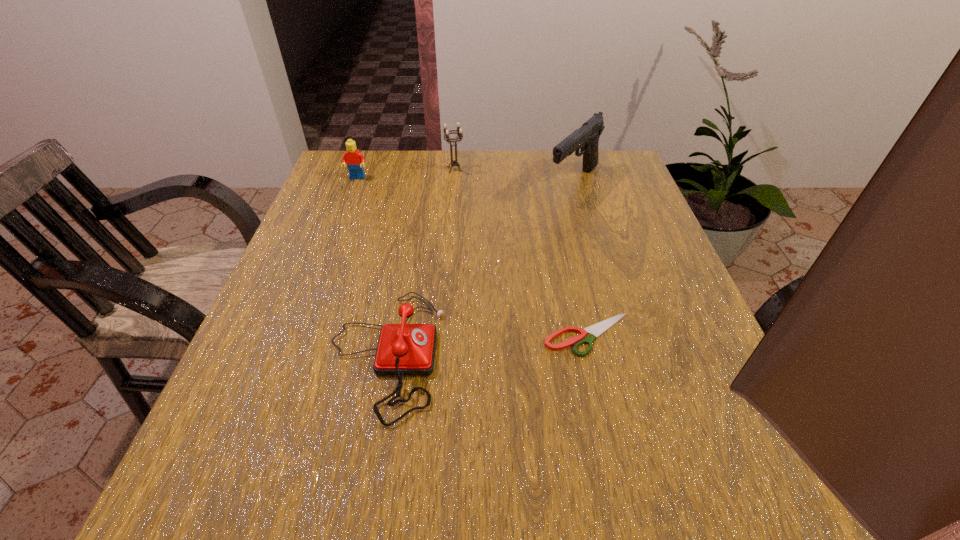
The height and width of the screenshot is (540, 960). Identify the location of free space located 0.160m on the front of the shortest object. (613, 448).

Where is `gun that is positioned at the far edge`? This screenshot has height=540, width=960. gun that is positioned at the far edge is located at coordinates (586, 138).

This screenshot has width=960, height=540. I want to click on candle holder that is at the far edge, so click(459, 130).

I want to click on Lego present at the far edge, so click(354, 159).

I want to click on Lego that is at the left edge, so click(354, 159).

The image size is (960, 540). Identify the location of telephone that is positioned at the left edge. (403, 349).

This screenshot has width=960, height=540. What are the coordinates of `gun that is at the right edge` in the screenshot? It's located at (586, 138).

Find the location of `scissors at the right edge`. scissors at the right edge is located at coordinates (597, 329).

Locate an element on the screen. Image resolution: width=960 pixels, height=540 pixels. object located in the far left corner section of the desktop is located at coordinates (354, 159).

Locate an element on the screen. The image size is (960, 540). object located at the far right corner is located at coordinates (586, 138).